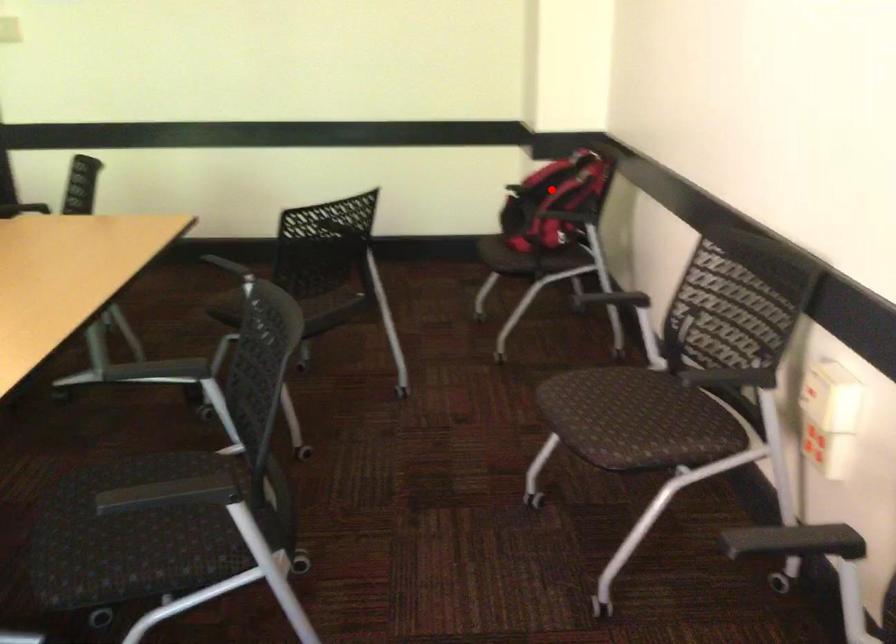
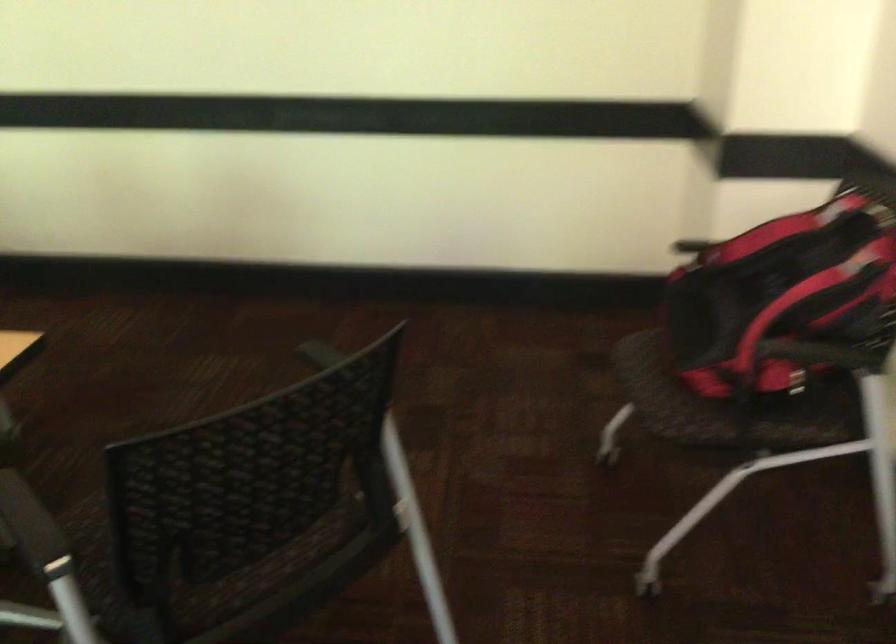
In the second image, find the point that corresponds to the highlighted location in the first image.

(785, 283)